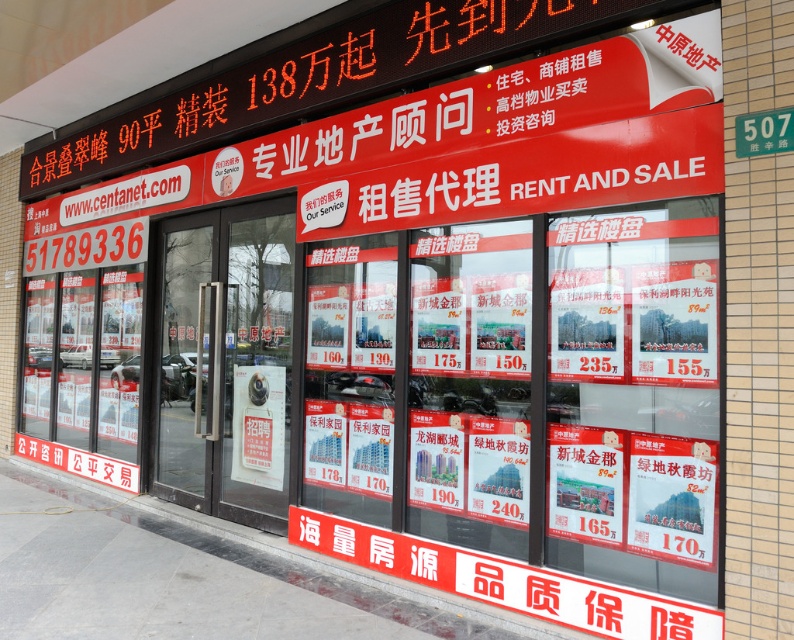
Question: Does red glossy poster at center have a lesser width compared to green metallic street sign at upper right?

Choices:
 (A) yes
 (B) no

Answer: (B)

Question: Can you confirm if white paper posters at center is smaller than transparent glass door at center?

Choices:
 (A) no
 (B) yes

Answer: (B)

Question: Where is red glossy poster at center located in relation to green metallic street sign at upper right in the image?

Choices:
 (A) above
 (B) below

Answer: (B)

Question: Which point is closer to the camera taking this photo?

Choices:
 (A) (272, 252)
 (B) (694, 458)
 (C) (572, 525)
 (D) (773, 115)

Answer: (D)

Question: Which object is the closest to the green metallic street sign at upper right?

Choices:
 (A) transparent glass door at center
 (B) white paper posters at center
 (C) red glossy poster at center

Answer: (B)

Question: Among these points, which one is farthest from the camera?

Choices:
 (A) (765, 134)
 (B) (218, 401)

Answer: (B)